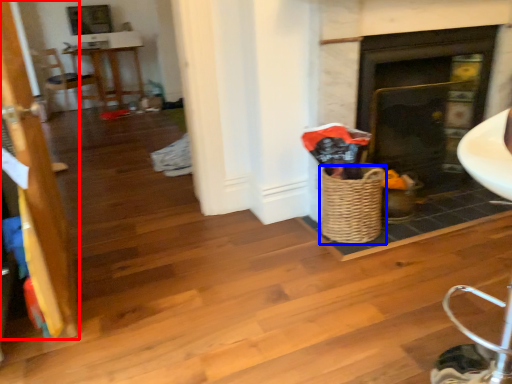
Question: Which of the following is the closest to the observer, door (highlighted by a red box) or basket (highlighted by a blue box)?

Choices:
 (A) door
 (B) basket

Answer: (A)